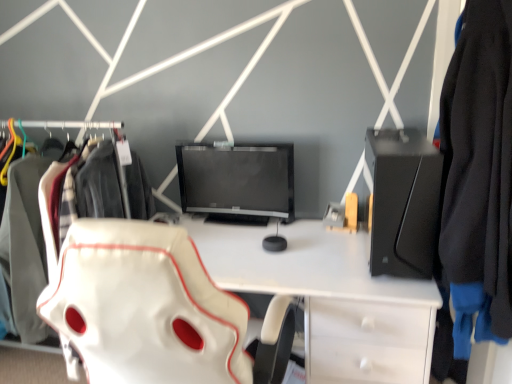
Question: Does black fabric jacket at right have a greater width compared to black matte desktop at right?

Choices:
 (A) no
 (B) yes

Answer: (A)

Question: Can we say black fabric jacket at right lies outside black matte desktop at right?

Choices:
 (A) no
 (B) yes

Answer: (B)

Question: Is the position of black fabric jacket at right less distant than that of black matte desktop at right?

Choices:
 (A) no
 (B) yes

Answer: (B)

Question: Is black fabric jacket at right directly adjacent to black matte desktop at right?

Choices:
 (A) yes
 (B) no

Answer: (B)

Question: Does black fabric jacket at right have a smaller size compared to black matte desktop at right?

Choices:
 (A) yes
 (B) no

Answer: (B)

Question: Based on their positions, is white fabric bag at left located to the left or right of white leather desk at center?

Choices:
 (A) right
 (B) left

Answer: (B)

Question: Is point (58, 124) positioned closer to the camera than point (243, 228)?

Choices:
 (A) farther
 (B) closer

Answer: (A)

Question: Looking at their shapes, would you say white fabric bag at left is wider or thinner than white leather desk at center?

Choices:
 (A) thin
 (B) wide

Answer: (A)

Question: Based on their sizes in the image, would you say white fabric bag at left is bigger or smaller than white leather desk at center?

Choices:
 (A) big
 (B) small

Answer: (A)

Question: Is white leather swivel chair at center taller or shorter than black fabric jacket at right?

Choices:
 (A) short
 (B) tall

Answer: (B)

Question: From the image's perspective, is white leather swivel chair at center above or below black fabric jacket at right?

Choices:
 (A) below
 (B) above

Answer: (A)

Question: In terms of width, does white leather swivel chair at center look wider or thinner when compared to black fabric jacket at right?

Choices:
 (A) wide
 (B) thin

Answer: (A)

Question: Do you think white leather swivel chair at center is within black fabric jacket at right, or outside of it?

Choices:
 (A) inside
 (B) outside

Answer: (B)

Question: From a real-world perspective, is white leather desk at center physically located above or below black matte desktop at right?

Choices:
 (A) above
 (B) below

Answer: (B)

Question: In terms of height, does white leather desk at center look taller or shorter compared to black matte desktop at right?

Choices:
 (A) short
 (B) tall

Answer: (B)